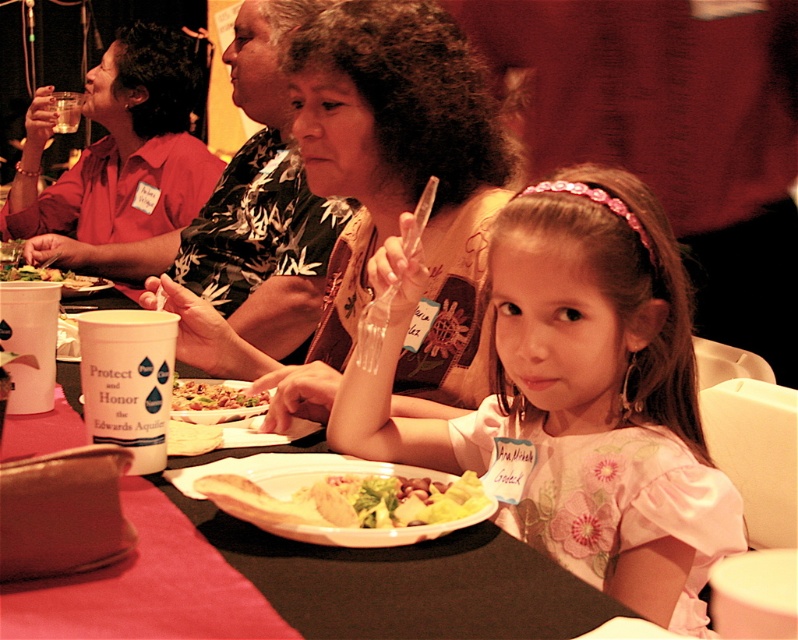
Question: Can you confirm if yellowish matte salad at center is positioned above yellowish matte plate at center?

Choices:
 (A) no
 (B) yes

Answer: (A)

Question: Estimate the real-world distances between objects in this image. Which object is farther from the yellowish matte plate at center?

Choices:
 (A) white paper plate at center
 (B) matte red shirt at upper left
 (C) pink floral dress at center
 (D) printed fabric shirt at center

Answer: (B)

Question: Which point is closer to the camera?

Choices:
 (A) green leafy salad at center
 (B) yellowish matte salad at center
 (C) yellowish matte plate at center

Answer: (B)

Question: Which point is closer to the camera taking this photo?

Choices:
 (A) (334, 577)
 (B) (81, 276)
 (C) (184, 173)

Answer: (A)

Question: Can you confirm if white paper plate at center is positioned to the right of yellowish matte plate at center?

Choices:
 (A) no
 (B) yes

Answer: (A)

Question: Does printed fabric shirt at center appear on the left side of yellowish matte plate at center?

Choices:
 (A) no
 (B) yes

Answer: (A)